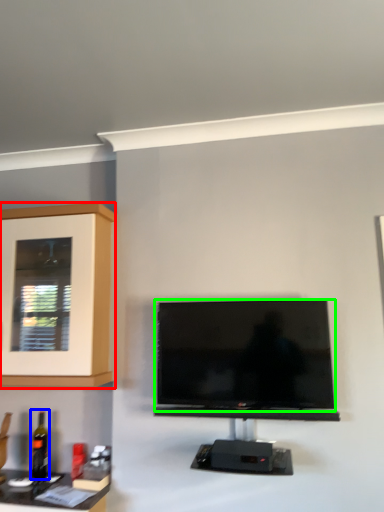
Question: Which object is the farthest from cabinetry (highlighted by a red box)? Choose among these: bottle (highlighted by a blue box) or television (highlighted by a green box).

Choices:
 (A) bottle
 (B) television

Answer: (A)